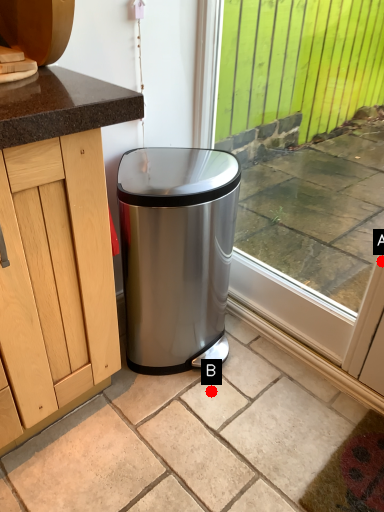
Question: Two points are circled on the image, labeled by A and B beside each circle. Which point is farther from the camera taking this photo?

Choices:
 (A) A is further
 (B) B is further

Answer: (B)